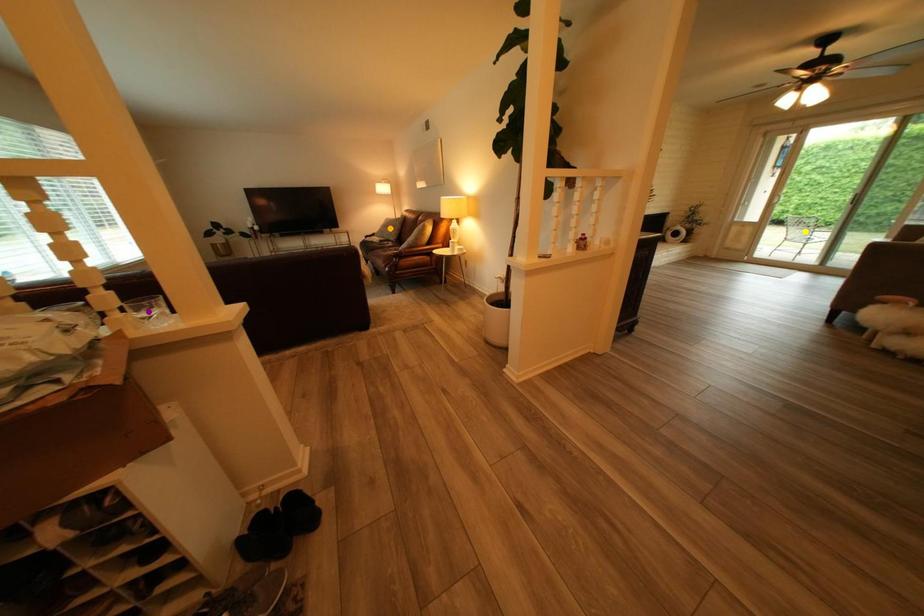
Consider the image. Order these from nearest to farthest:
yellow point, orange point, purple point

purple point < orange point < yellow point